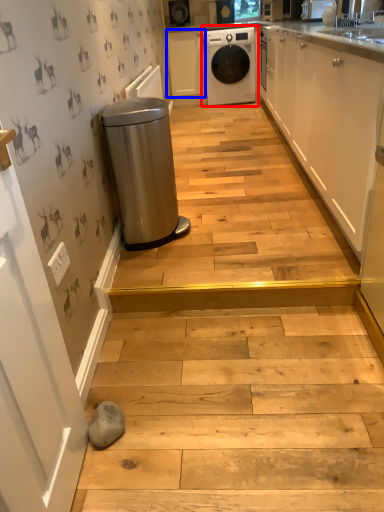
Question: Which point is closer to the camera, home appliance (highlighted by a red box) or cabinetry (highlighted by a blue box)?

Choices:
 (A) home appliance
 (B) cabinetry

Answer: (A)